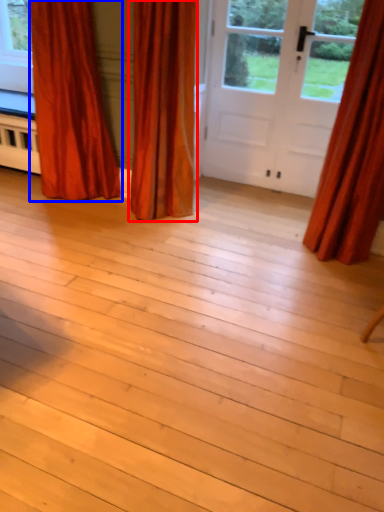
Question: Which point is further to the camera, curtain (highlighted by a red box) or curtain (highlighted by a blue box)?

Choices:
 (A) curtain
 (B) curtain

Answer: (B)